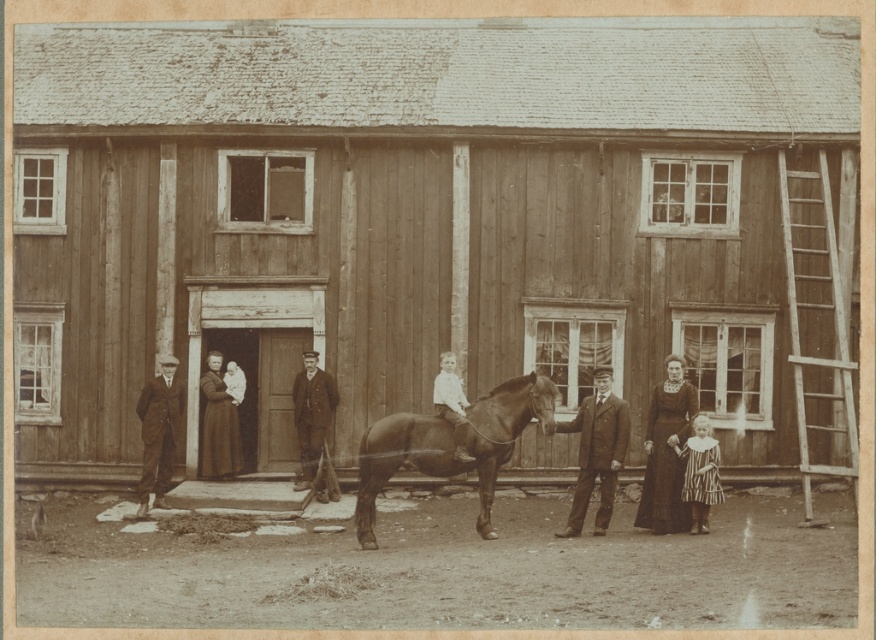
Question: Does wooden barn at center appear under smooth brown suit at center?

Choices:
 (A) yes
 (B) no

Answer: (B)

Question: Can you confirm if brown glossy horse at center is thinner than matte black dress at center?

Choices:
 (A) no
 (B) yes

Answer: (A)

Question: Which is nearer to the dark brown suit at left?

Choices:
 (A) matte black dress at center
 (B) wooden barn at center
 (C) dark brown dress at center
 (D) brown glossy horse at center

Answer: (A)

Question: Which object is positioned closest to the brown glossy horse at center?

Choices:
 (A) matte black dress at center
 (B) dark brown suit at left
 (C) wooden barn at center

Answer: (B)

Question: From the image, what is the correct spatial relationship of wooden barn at center in relation to dark brown suit at left?

Choices:
 (A) right
 (B) left

Answer: (A)

Question: Which of the following is the closest to the observer?

Choices:
 (A) dark brown suit at center
 (B) dark brown dress at center

Answer: (B)